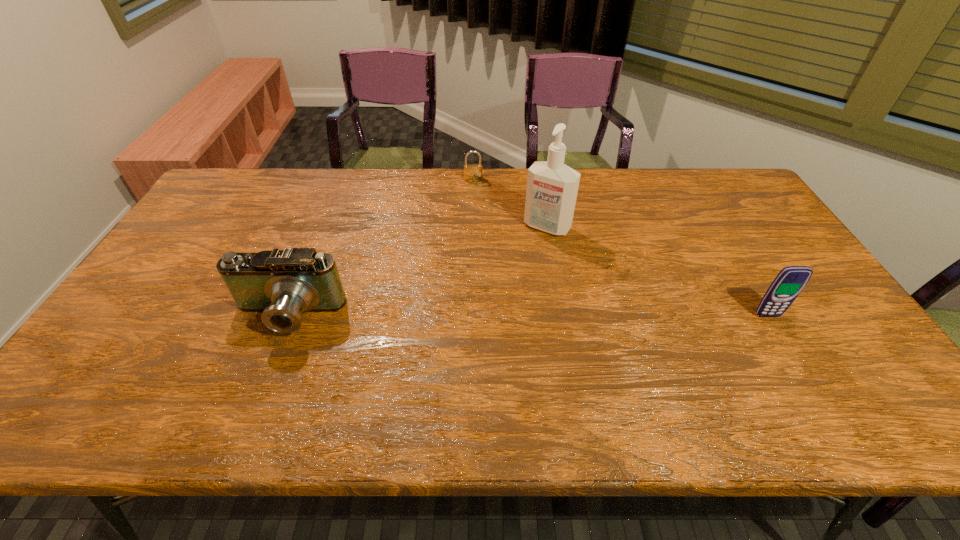
Find the location of `vacant space on the desktop that is between the leftmost object and the rightmost object and is positioned on the front label of the tallest object`. vacant space on the desktop that is between the leftmost object and the rightmost object and is positioned on the front label of the tallest object is located at coordinates 484,316.

In order to click on free spot on the desktop that is between the camcorder and the rightmost object and is positioned on the front-facing side of the farthest object in this screenshot , I will do `click(505, 316)`.